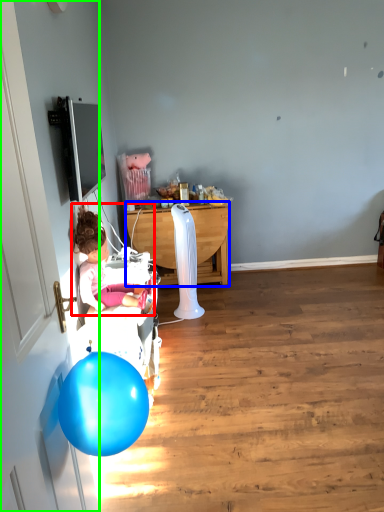
Question: Which object is positioned closest to person (highlighted by a red box)? Select from desk (highlighted by a blue box) and door (highlighted by a green box).

Choices:
 (A) desk
 (B) door

Answer: (B)